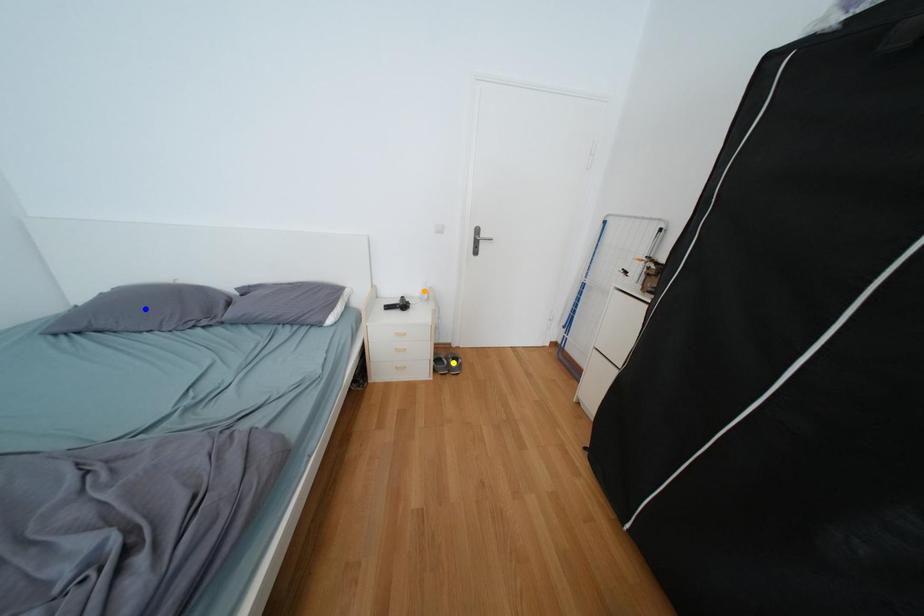
Order these from nearest to farthest:
blue point
yellow point
orange point

yellow point
orange point
blue point